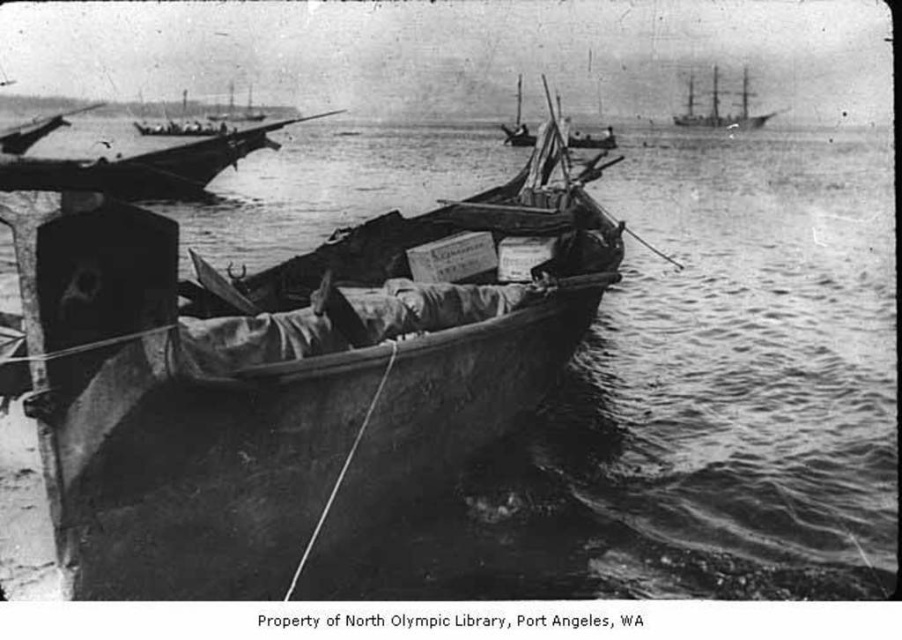
Can you confirm if wooden boat at center is positioned above wooden boat at upper left?

No, wooden boat at center is not above wooden boat at upper left.

Who is positioned more to the left, wooden boat at center or wooden boat at upper left?

wooden boat at upper left is more to the left.

Locate an element on the screen. Image resolution: width=902 pixels, height=640 pixels. wooden boat at center is located at coordinates (284, 374).

Does point (380, 218) come closer to viewer compared to point (696, 113)?

Yes, point (380, 218) is closer to viewer.

I want to click on wooden boat at center, so click(284, 374).

Locate an element on the screen. The width and height of the screenshot is (902, 640). wooden boat at center is located at coordinates (284, 374).

Who is positioned more to the right, wooden boat at center or rusty metal boat at center?

rusty metal boat at center is more to the right.

Which is in front, point (183, 406) or point (534, 144)?

Point (183, 406) is in front.

The height and width of the screenshot is (640, 902). In order to click on wooden boat at center in this screenshot , I will do `click(284, 374)`.